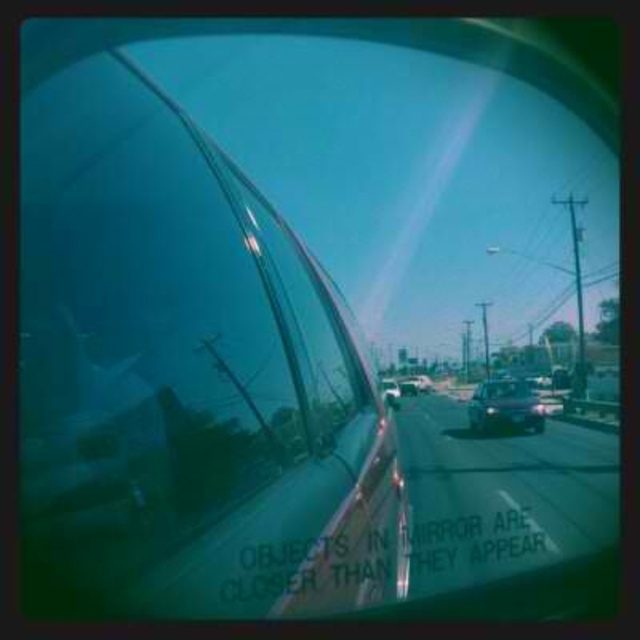
Question: Which point is farther to the camera?

Choices:
 (A) (477, 424)
 (B) (225, 154)

Answer: (A)

Question: Among these objects, which one is nearest to the camera?

Choices:
 (A) shiny metallic car at center
 (B) shiny silver sedan at center

Answer: (B)

Question: Does transparent glass car window at center have a greater width compared to shiny metallic car at center?

Choices:
 (A) no
 (B) yes

Answer: (B)

Question: Does transparent glass car window at center appear on the right side of shiny metallic car at center?

Choices:
 (A) no
 (B) yes

Answer: (A)

Question: Observing the image, what is the correct spatial positioning of transparent glass car window at center in reference to shiny silver sedan at center?

Choices:
 (A) below
 (B) above

Answer: (B)

Question: Which point is closer to the camera?

Choices:
 (A) shiny metallic car at center
 (B) transparent glass car window at center
 (C) shiny silver sedan at center

Answer: (B)